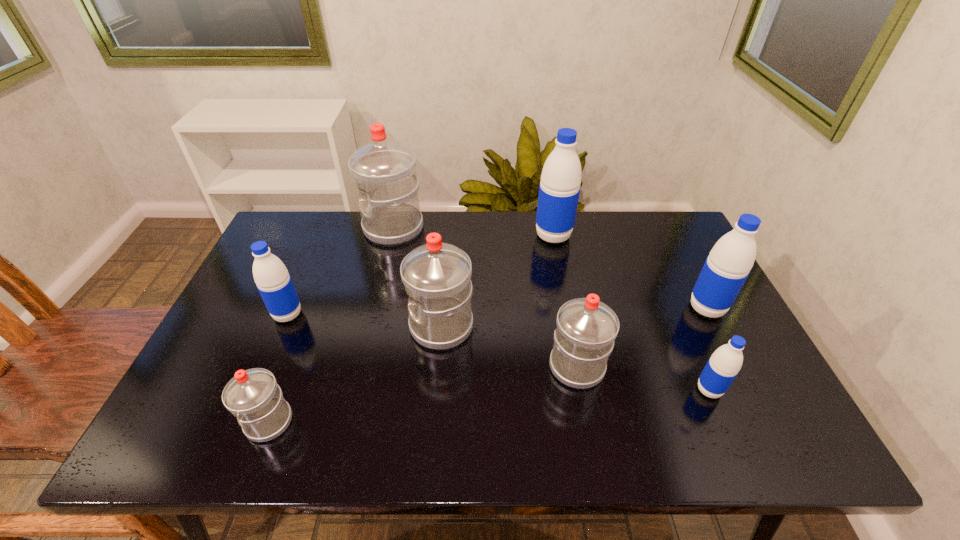
Locate an element on the screen. This screenshot has height=540, width=960. vacant space situated 0.380m on the handle side of the second white water bottle from right to left is located at coordinates (266, 326).

Where is `free space located on the handle side of the second white water bottle from right to left`? This screenshot has width=960, height=540. free space located on the handle side of the second white water bottle from right to left is located at coordinates (323, 326).

Image resolution: width=960 pixels, height=540 pixels. In order to click on free space located 0.270m on the handle side of the rightmost white water bottle in this screenshot , I will do `click(559, 273)`.

At what (x,y) coordinates should I click in order to perform the action: click on vacant region located 0.330m on the handle side of the rightmost white water bottle. Please return your answer as a coordinate pair (x, y). The width and height of the screenshot is (960, 540). Looking at the image, I should click on (556, 260).

You are a GUI agent. You are given a task and a screenshot of the screen. Output one action in this format:
    pyautogui.click(x=<x>, y=<y>)
    Task: Click on the vacant area situated 0.200m on the handle side of the rightmost white water bottle
    
    Given the screenshot: What is the action you would take?
    pyautogui.click(x=562, y=289)

Where is `free space located on the front of the second smallest blue water bottle`? The width and height of the screenshot is (960, 540). free space located on the front of the second smallest blue water bottle is located at coordinates (276, 344).

The height and width of the screenshot is (540, 960). I want to click on free space located on the left of the seventh object from left to right, so click(x=632, y=390).

This screenshot has height=540, width=960. Identify the location of free space located 0.150m on the handle side of the nearest white water bottle. (178, 422).

This screenshot has height=540, width=960. In order to click on vacant region located 0.090m on the handle side of the nearest white water bottle in this screenshot , I will do `click(204, 422)`.

You are a GUI agent. You are given a task and a screenshot of the screen. Output one action in this format:
    pyautogui.click(x=<x>, y=<y>)
    Task: Click on the object that is at the near edge
    The width and height of the screenshot is (960, 540).
    Given the screenshot: What is the action you would take?
    pyautogui.click(x=253, y=396)